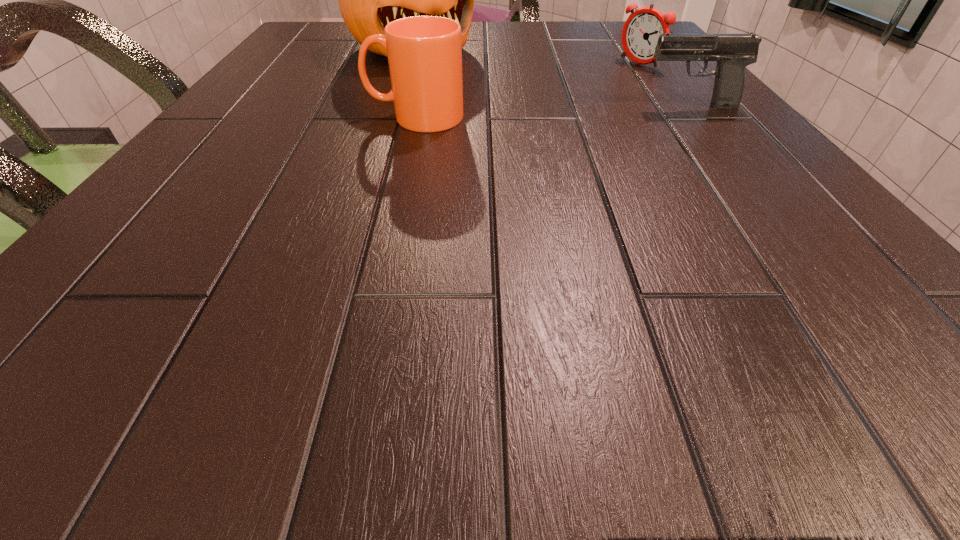
The height and width of the screenshot is (540, 960). Identify the location of free space between the pumpkin and the alarm clock. (x=525, y=56).

Where is `free spot between the tallest object and the pistol`? The image size is (960, 540). free spot between the tallest object and the pistol is located at coordinates (551, 77).

Find the location of a particular element. vacant area that lies between the pistol and the alarm clock is located at coordinates (664, 85).

Locate an element on the screen. The height and width of the screenshot is (540, 960). free point between the tallest object and the pistol is located at coordinates (551, 77).

Find the location of a particular element. vacant space in between the mug and the alarm clock is located at coordinates point(527,91).

Find the location of `blank region between the alarm clock and the tallest object`. blank region between the alarm clock and the tallest object is located at coordinates (525, 56).

Locate an element on the screen. The image size is (960, 540). object that is the third nearest to the pistol is located at coordinates (368, 0).

Locate which object ranks second in proximity to the mug. Please provide its 2D coordinates. Your answer should be formatted as a tuple, i.e. [(x, y)], where the tuple contains the x and y coordinates of a point satisfying the conditions above.

[(733, 52)]

At what (x,y) coordinates should I click in order to perform the action: click on vacant space that satisfies the following two spatial constraints: 1. on the front side of the tallest object; 2. aim along the barrel of the pistol. Please return your answer as a coordinate pair (x, y). Looking at the image, I should click on coord(393,106).

Find the location of a particular element. This screenshot has width=960, height=540. free space that satisfies the following two spatial constraints: 1. on the front side of the pistol; 2. aim along the barrel of the pumpkin is located at coordinates [x=393, y=106].